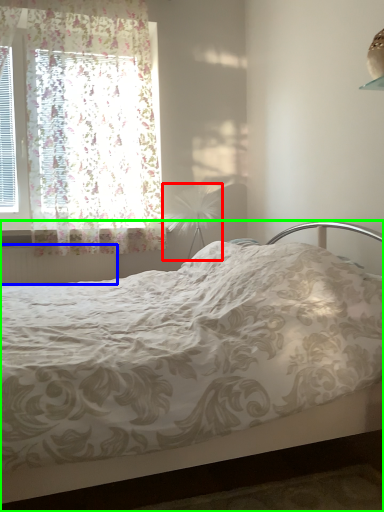
Question: Considering the real-world distances, which object is farthest from table lamp (highlighted by a red box)? radiator (highlighted by a blue box) or bed (highlighted by a green box)?

Choices:
 (A) radiator
 (B) bed

Answer: (B)